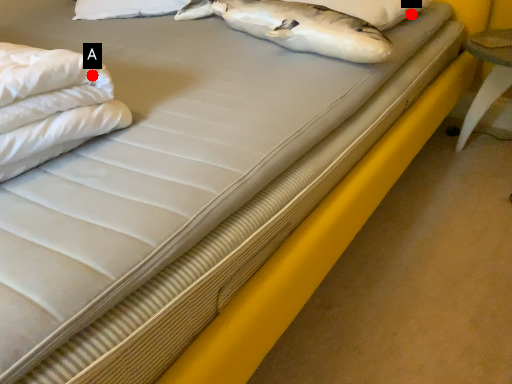
Question: Two points are circled on the image, labeled by A and B beside each circle. Which point is farther to the camera?

Choices:
 (A) A is further
 (B) B is further

Answer: (B)